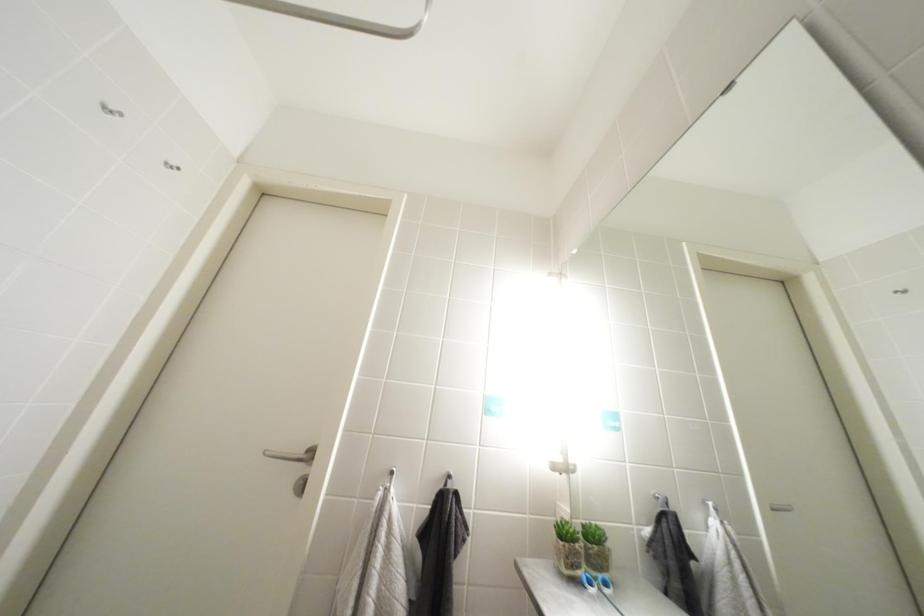
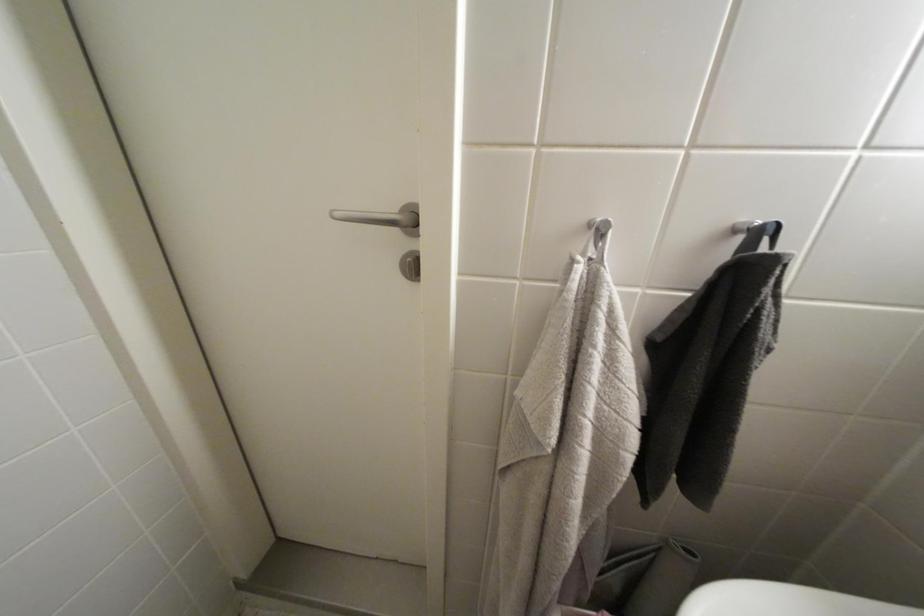
The images are taken continuously from a first-person perspective. In which direction is your viewpoint rotating?

The camera's rotation is toward left-down.